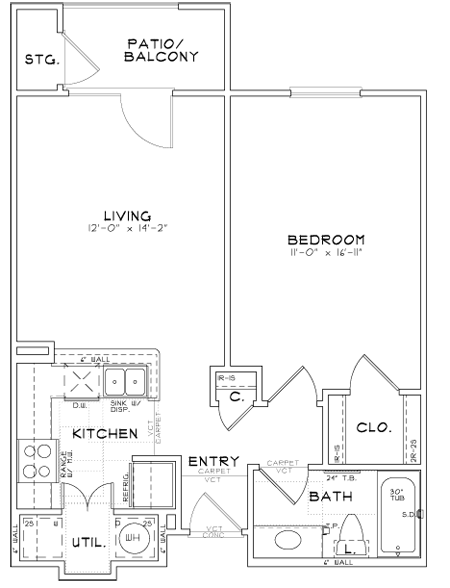
I want to click on stove, so click(42, 459).